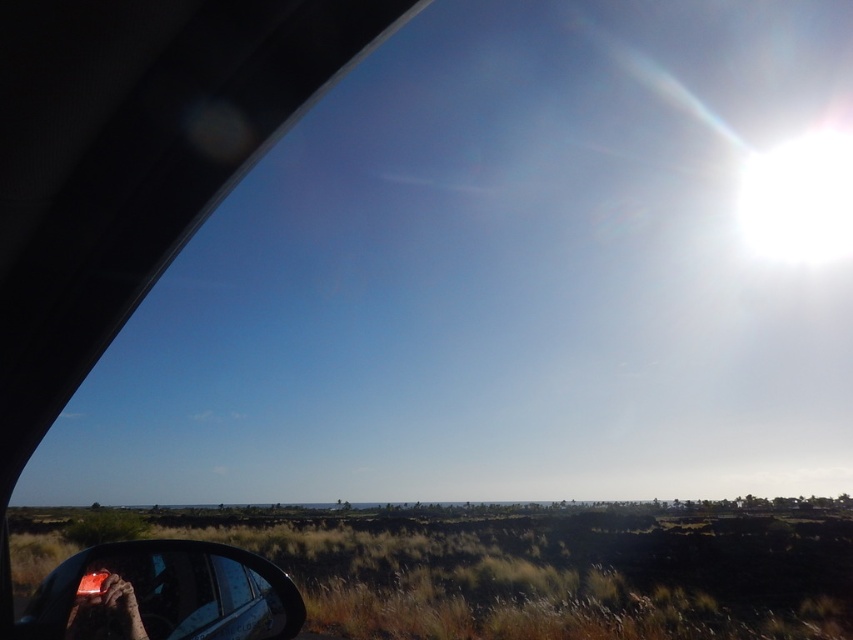
Question: Observing the image, what is the correct spatial positioning of grassy field at lower center in reference to leather glove at lower left?

Choices:
 (A) left
 (B) right

Answer: (B)

Question: Which point is farther to the camera?

Choices:
 (A) (91, 604)
 (B) (614, 529)
 (C) (99, 557)

Answer: (B)

Question: Among these points, which one is nearest to the camera?

Choices:
 (A) (105, 616)
 (B) (193, 545)
 (C) (724, 525)

Answer: (A)

Question: Which point appears closest to the camera in this image?

Choices:
 (A) pos(73,621)
 (B) pos(722,602)
 (C) pos(79,602)

Answer: (A)

Question: In this image, where is grassy field at lower center located relative to matte black rearview mirror at lower left?

Choices:
 (A) right
 (B) left

Answer: (A)

Question: Does grassy field at lower center have a smaller size compared to matte black rearview mirror at lower left?

Choices:
 (A) yes
 (B) no

Answer: (B)